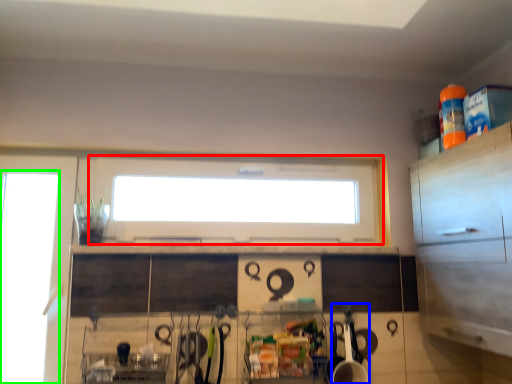
Question: Based on their relative distances, which object is farther from window (highlighted by a red box)? Choose from appliance (highlighted by a blue box) and glass door (highlighted by a green box).

Choices:
 (A) appliance
 (B) glass door

Answer: (A)